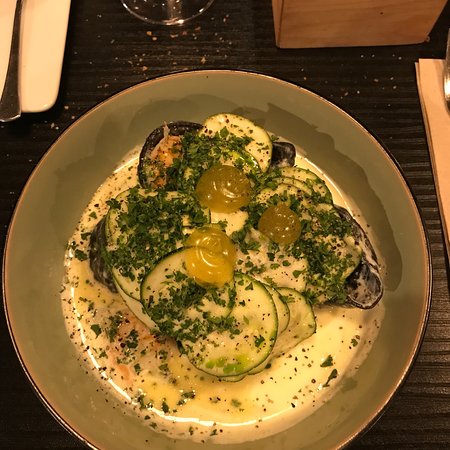
Locate an element on the screen. food dish is located at coordinates 240,276.